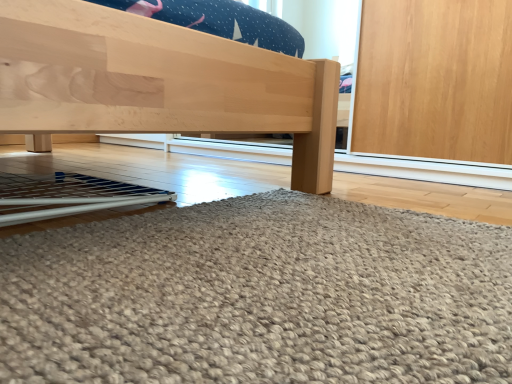
Find the location of a particular element. free region under wooden door at lower right (from a real-world perspective) is located at coordinates (230, 285).